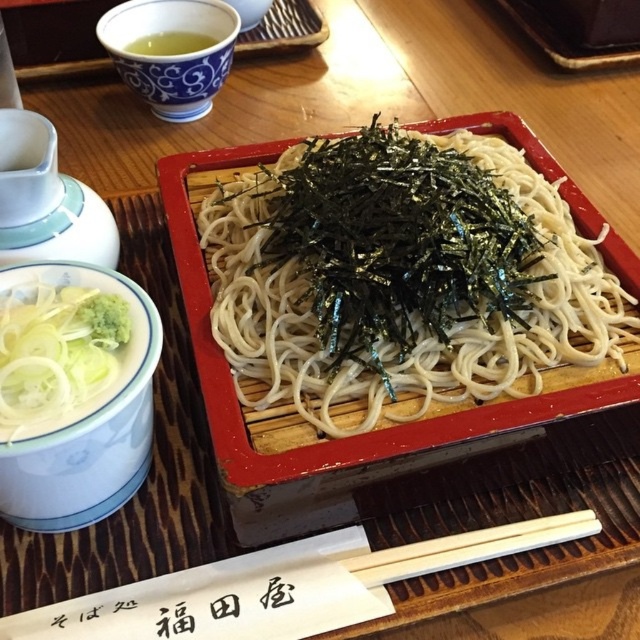
Question: Is white matte noodles at center to the left of matte porcelain bowl at upper left from the viewer's perspective?

Choices:
 (A) yes
 (B) no

Answer: (B)

Question: Observing the image, what is the correct spatial positioning of white translucent noodles at left in reference to matte porcelain bowl at upper left?

Choices:
 (A) above
 (B) below

Answer: (B)

Question: Which of the following is the closest to the observer?

Choices:
 (A) (198, 49)
 (B) (99, 515)
 (C) (252, 26)
 (D) (97, 32)

Answer: (B)

Question: Which of the following is the closest to the observer?

Choices:
 (A) (36, 332)
 (B) (157, 38)
 (C) (268, 4)

Answer: (A)

Question: Which of the following is the closest to the observer?

Choices:
 (A) green liquid at upper left
 (B) white wood chopsticks at lower center
 (C) matte porcelain bowl at upper left
 (D) white translucent noodles at left

Answer: (D)

Question: Is green liquid at upper left to the right of matte porcelain bowl at upper left from the viewer's perspective?

Choices:
 (A) yes
 (B) no

Answer: (B)